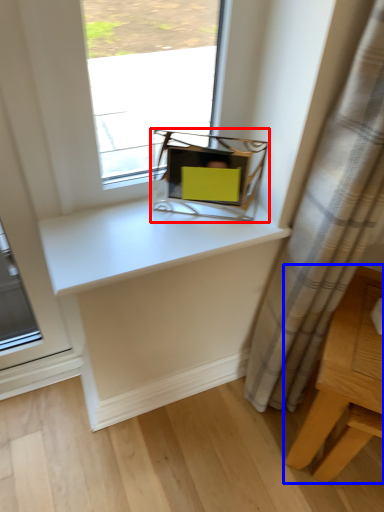
Question: Which object appears closest to the camera in this image, equipment (highlighted by a red box) or table (highlighted by a blue box)?

Choices:
 (A) equipment
 (B) table

Answer: (B)